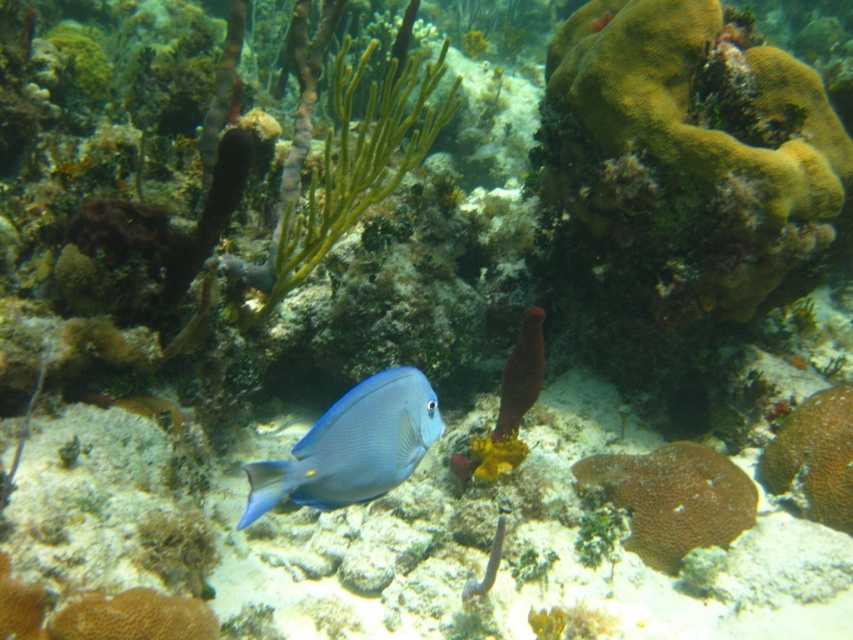
From the picture: Can you confirm if blue glossy fish at center is positioned to the left of brown textured coral at center?

Yes, blue glossy fish at center is to the left of brown textured coral at center.

Locate an element on the screen. blue glossy fish at center is located at coordinates (352, 445).